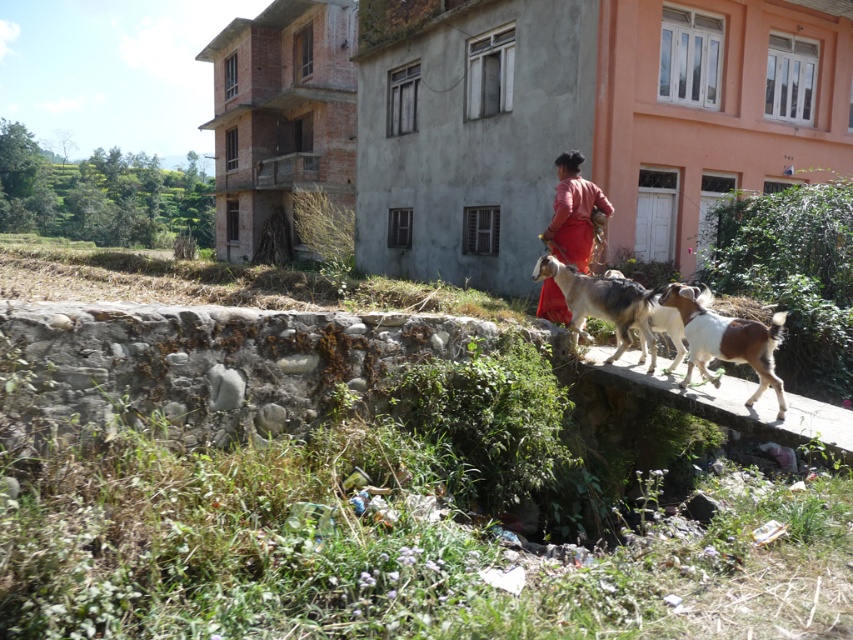
Question: Does white and brown fur at center appear on the right side of brown and white fur at center?

Choices:
 (A) yes
 (B) no

Answer: (A)

Question: Can you confirm if brown stone ledge at center is positioned to the left of white and brown fur at center?

Choices:
 (A) no
 (B) yes

Answer: (A)

Question: Which of these objects is positioned closest to the brown and white fur at center?

Choices:
 (A) brown stone ledge at center
 (B) matte red dress at center

Answer: (B)

Question: Is white and brown fur at center smaller than brown and white fur at center?

Choices:
 (A) no
 (B) yes

Answer: (B)

Question: Considering the real-world distances, which object is closest to the matte red dress at center?

Choices:
 (A) brown stone ledge at center
 (B) brown and white fur at center
 (C) white and brown fur at center

Answer: (B)

Question: Which point is farther to the camera?

Choices:
 (A) (624, 362)
 (B) (730, 340)
 (C) (643, 296)

Answer: (A)